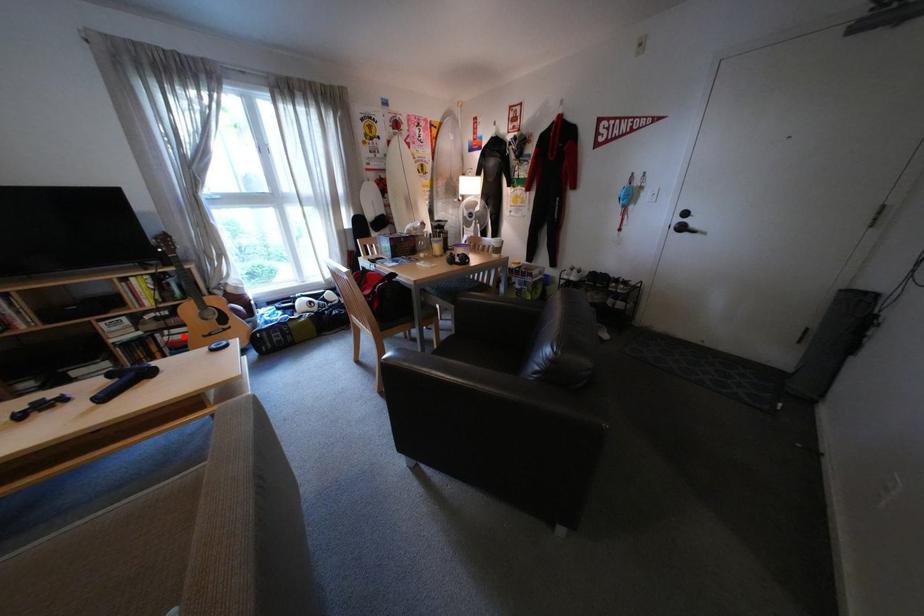
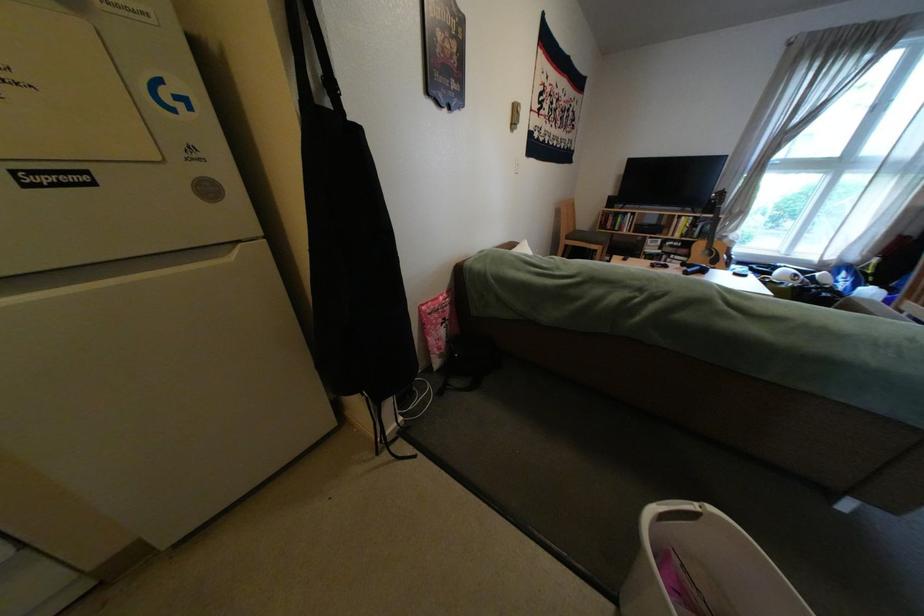
Question: I am providing you with two images of the same scene from different viewpoints. A red point is shown in image1. For the corresponding object point in image2, is it positioned nearer or farther from the camera?

Choices:
 (A) Nearer
 (B) Farther

Answer: (B)